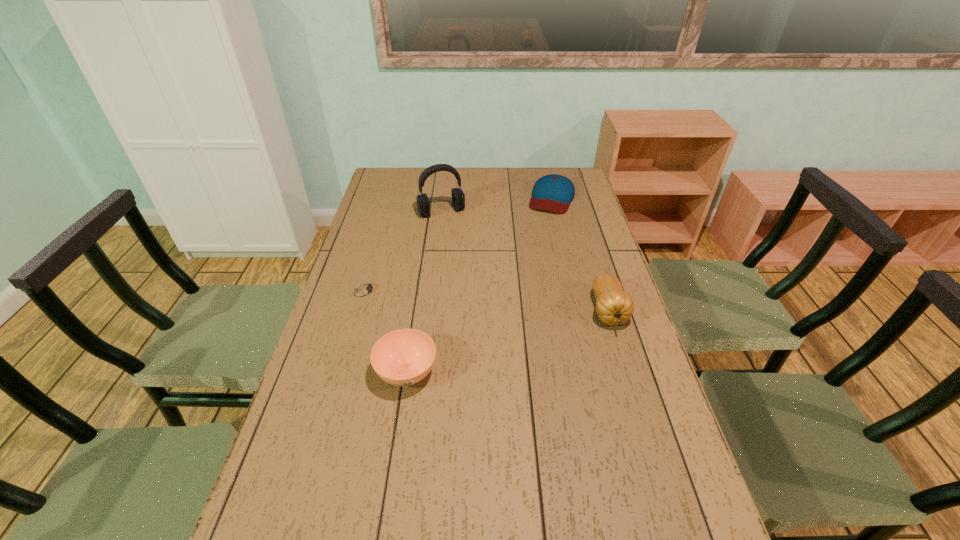
This screenshot has height=540, width=960. Identify the location of vacant space on the desktop that is between the soup bowl and the fourth shortest object and is positioned on the headband of the headset. (511, 341).

Where is `free space on the desktop that is between the nearest object and the gourd and is positioned with the bill of the baseball cap facing forward`? The height and width of the screenshot is (540, 960). free space on the desktop that is between the nearest object and the gourd and is positioned with the bill of the baseball cap facing forward is located at coordinates (492, 347).

This screenshot has height=540, width=960. Find the location of `vacant spot on the desktop that is between the soup bowl and the gourd and is positioned on the face of the leftmost object`. vacant spot on the desktop that is between the soup bowl and the gourd and is positioned on the face of the leftmost object is located at coordinates (541, 332).